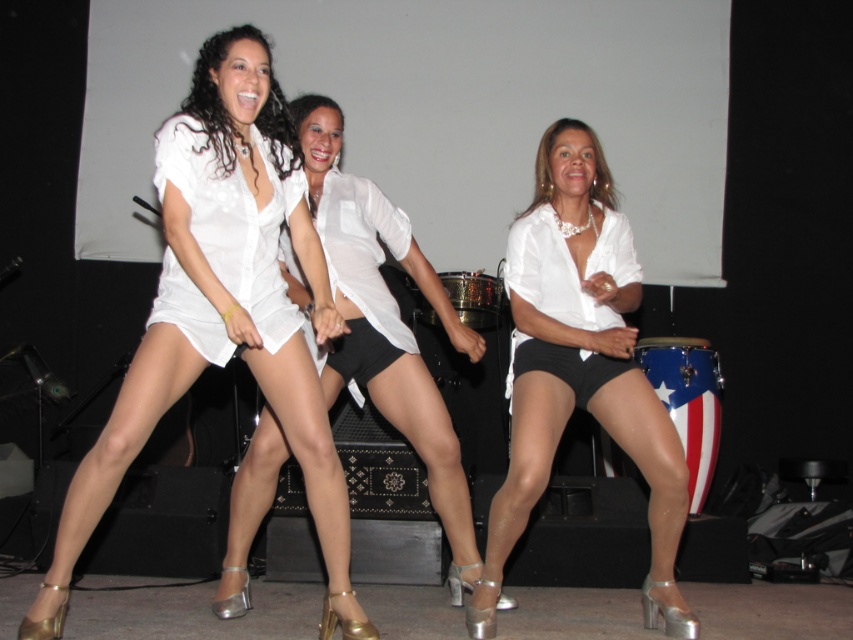
Question: Is white glossy blouse at center positioned behind white satin blouse at center?

Choices:
 (A) yes
 (B) no

Answer: (B)

Question: Among these points, which one is nearest to the camera?

Choices:
 (A) (190, 118)
 (B) (593, 236)
 (C) (181, 353)

Answer: (C)

Question: Does white satin dress at center appear on the left side of white glossy blouse at center?

Choices:
 (A) no
 (B) yes

Answer: (B)

Question: Considering the real-world distances, which object is farthest from the white satin blouse at center?

Choices:
 (A) white satin dress at center
 (B) white glossy blouse at center

Answer: (B)

Question: Estimate the real-world distances between objects in this image. Which object is farther from the white satin blouse at center?

Choices:
 (A) white sheer dress at center
 (B) white glossy blouse at center

Answer: (B)

Question: Is the position of white satin blouse at center less distant than that of white sheer dress at center?

Choices:
 (A) yes
 (B) no

Answer: (B)